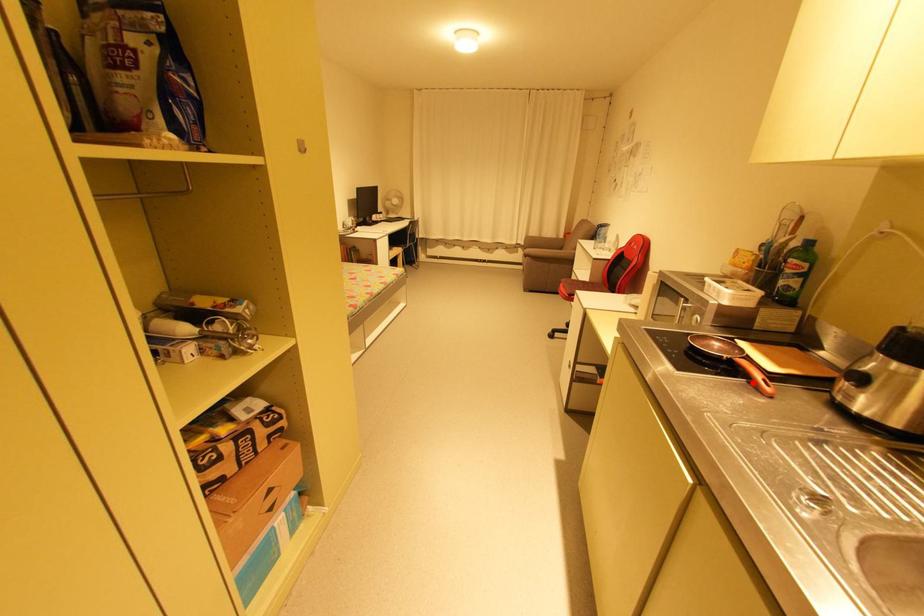
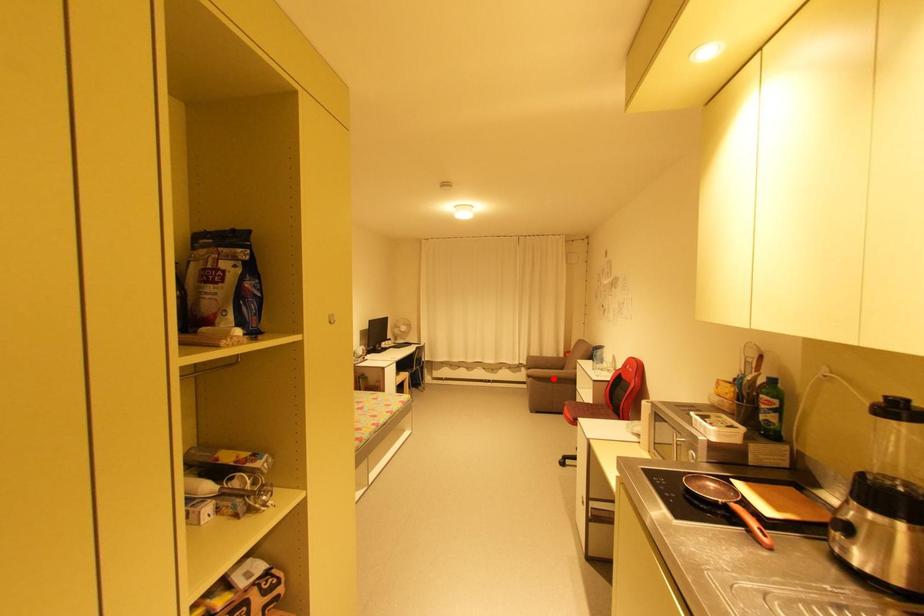
I am providing you with two images of the same scene from different viewpoints. A red point is marked on the first image and another point is marked on the second image. Is the red point in image1 aligned with the point shown in image2?

No